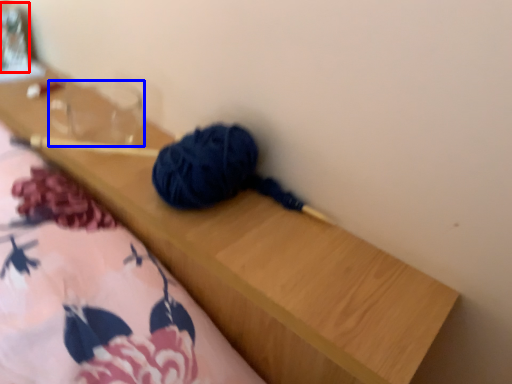
Question: Which point is closer to the camera, glass jar (highlighted by a red box) or clear (highlighted by a blue box)?

Choices:
 (A) glass jar
 (B) clear

Answer: (B)